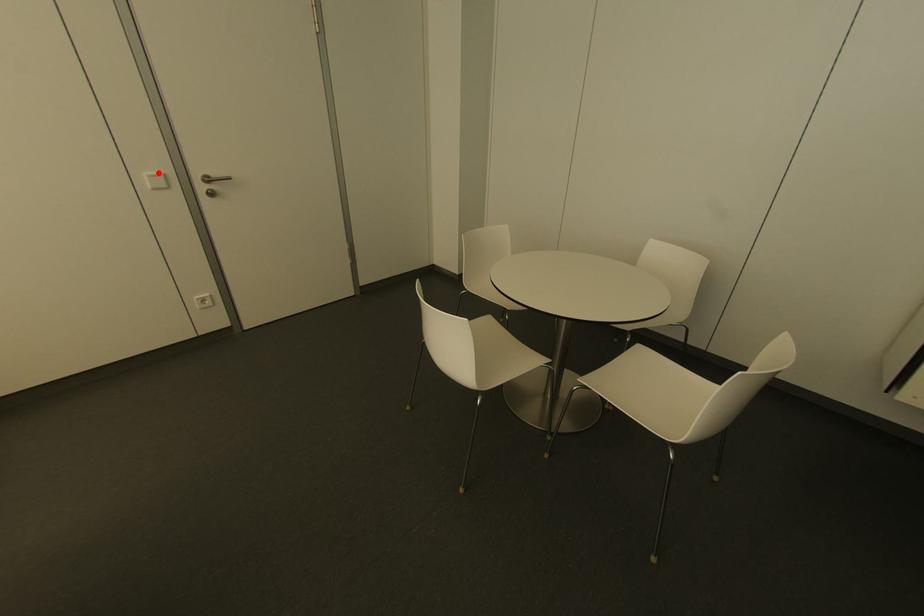
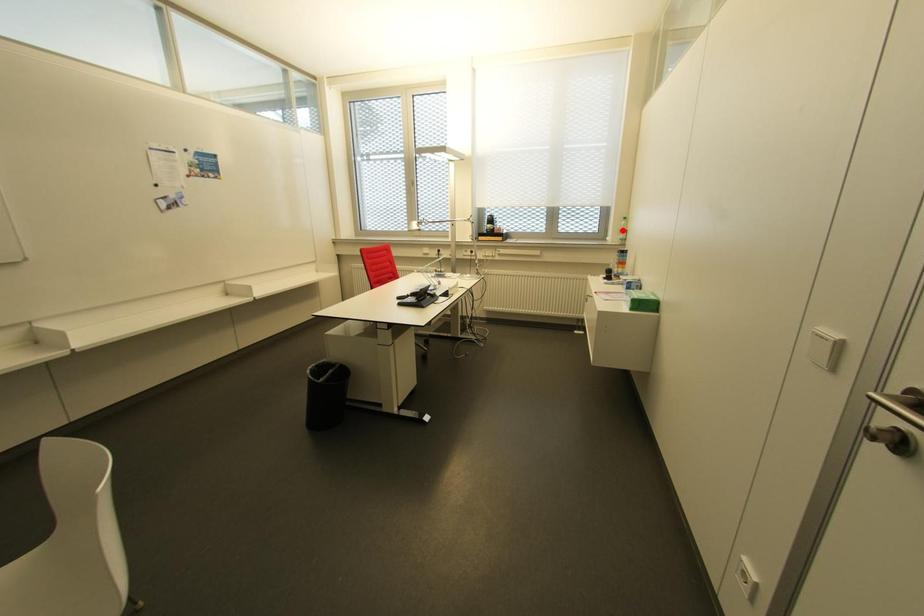
I am providing you with two images of the same scene from different viewpoints. A red point is marked on the first image and another point is marked on the second image. Are the points marked in image1 and image2 representing the same 3D position?

No